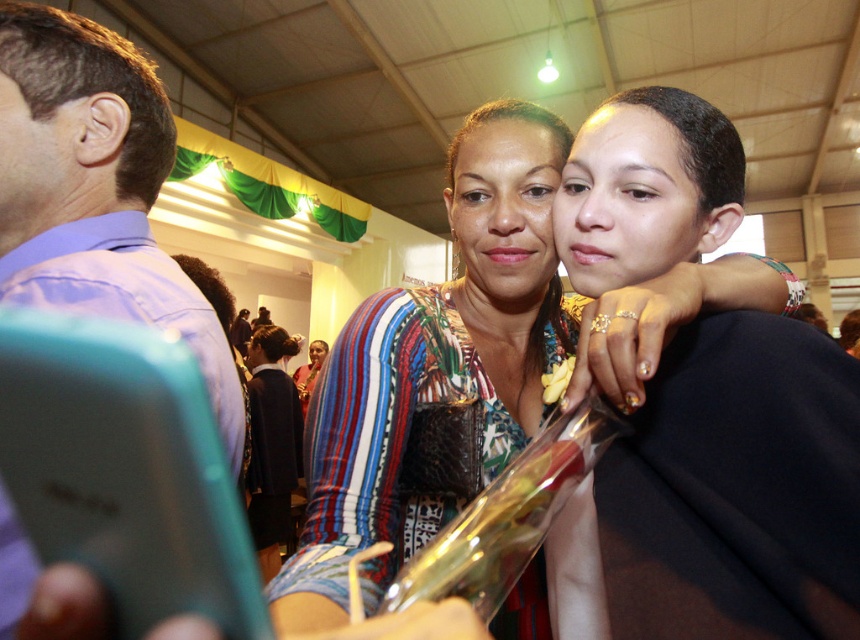
Question: Can you confirm if multicolored fabric scarf at upper right is bigger than purple cotton shirt at left?

Choices:
 (A) no
 (B) yes

Answer: (A)

Question: Does multicolored fabric scarf at upper right have a larger size compared to purple cotton shirt at left?

Choices:
 (A) no
 (B) yes

Answer: (A)

Question: Is multicolored fabric scarf at upper right above purple cotton shirt at left?

Choices:
 (A) no
 (B) yes

Answer: (A)